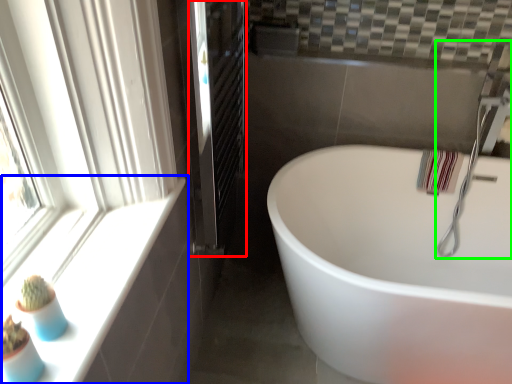
Question: Estimate the real-world distances between objects in this image. Which object is farther from screen door (highlighted by a red box), window sill (highlighted by a blue box) or faucet (highlighted by a green box)?

Choices:
 (A) window sill
 (B) faucet

Answer: (B)